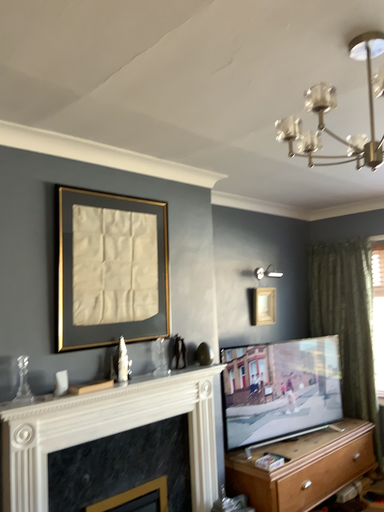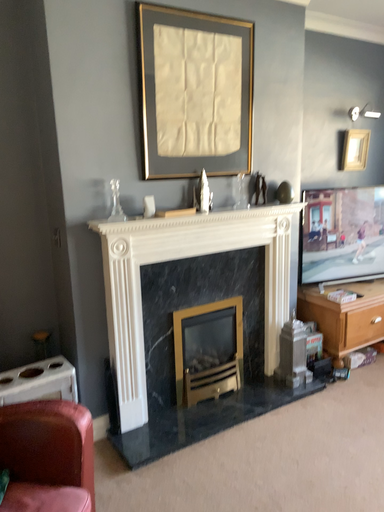
Question: How did the camera likely rotate when shooting the video?

Choices:
 (A) rotated left
 (B) rotated right

Answer: (A)